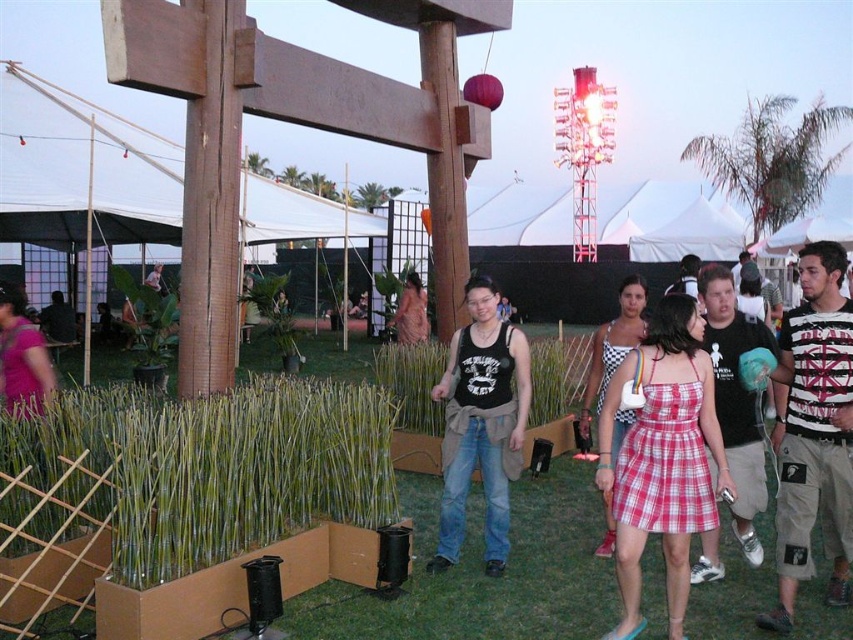
You are organizing a photoshoot and need to position two outfits in the center of the scene. The red plaid dress at center and the black cotton tank top at center must be placed such that they are exactly 24 inches apart. Based on their current positions, do you need to move them closer or farther apart to meet this requirement?

The red plaid dress at center is currently 23.31 inches from the black cotton tank top at center. To achieve the desired 24 inches, you need to move them slightly farther apart.

You are at the coordinates point 0.0, 0.0. You want to move to the red plaid dress at center. Which direction should you move?

You should move towards the coordinates point (662,458) to reach the red plaid dress at center.

You are attending an evening event and notice a white fabric canopy at center and a black tank top at center. From your perspective, which object is positioned to the left?

The white fabric canopy at center is to the left of the black tank top at center.